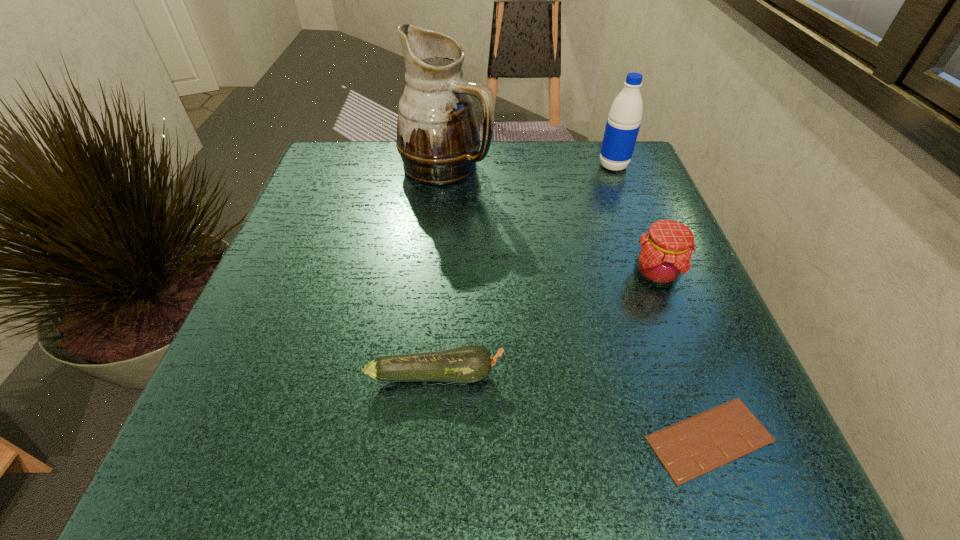
The width and height of the screenshot is (960, 540). Identify the location of object that is at the near right corner. (690, 448).

Image resolution: width=960 pixels, height=540 pixels. Find the location of `vacant area at the far edge`. vacant area at the far edge is located at coordinates (389, 187).

In the image, there is a desktop. Identify the location of vacant space at the near edge. (504, 446).

Locate an element on the screen. vacant area at the left edge of the desktop is located at coordinates (322, 238).

Find the location of a particular element. The image size is (960, 540). vacant space at the right edge of the desktop is located at coordinates (708, 302).

You are a GUI agent. You are given a task and a screenshot of the screen. Output one action in this format:
    pyautogui.click(x=<x>, y=<y>)
    Task: Click on the free region at the far left corner of the desktop
    This screenshot has width=960, height=540.
    Given the screenshot: What is the action you would take?
    pyautogui.click(x=324, y=155)

Image resolution: width=960 pixels, height=540 pixels. In the image, there is a desktop. What are the coordinates of `vacant space at the near left corner` in the screenshot? It's located at (295, 448).

In the image, there is a desktop. Identify the location of free region at the far right corner. coord(637,180).

This screenshot has width=960, height=540. Find the location of `empty location between the shortest object and the tallest object`. empty location between the shortest object and the tallest object is located at coordinates (578, 303).

Image resolution: width=960 pixels, height=540 pixels. I want to click on free spot between the tallest object and the water bottle, so click(530, 166).